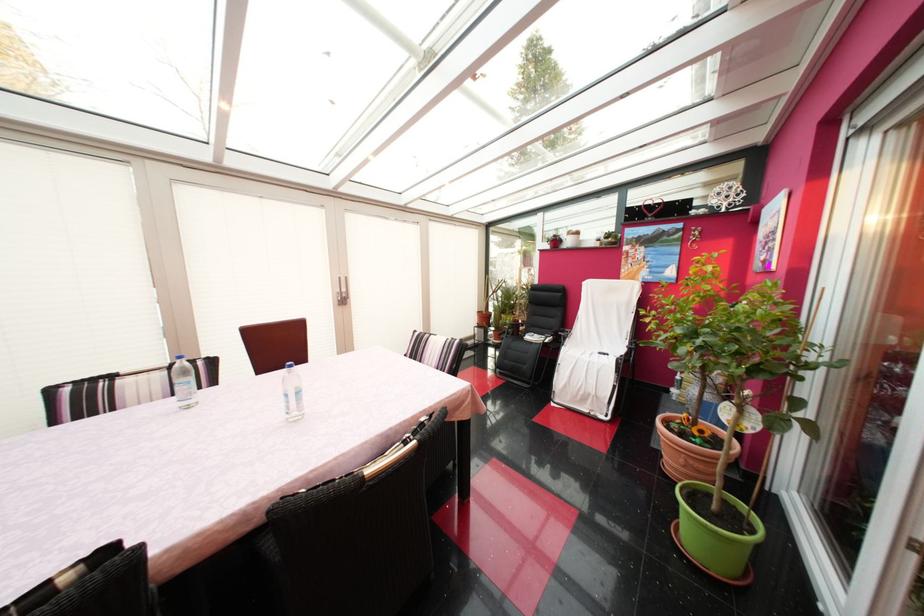
Where is `metal door handle`? metal door handle is located at coordinates (343, 291).